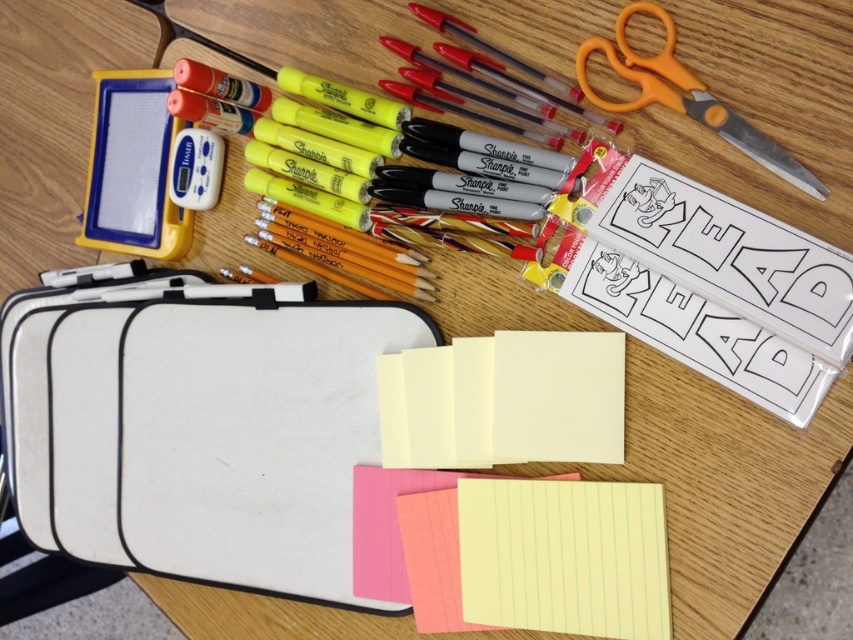
You are organizing school supplies on a desk and need to place a new item between the yellow paper notepad at center and the orange plastic scissors at upper right. Which object should you place the new item closer to based on their heights?

The yellow paper notepad at center is shorter than the orange plastic scissors at upper right. Therefore, the new item should be placed closer to the yellow paper notepad at center since it is shorter.

You are organizing school supplies on a desk. You have an orange plastic scissors at upper right and a lined paper at center. Which object is taller?

The orange plastic scissors at upper right is much taller than the lined paper at center.

You are organizing a classroom and need to place a new item on the desk. The desk has a wooden surface with school supplies arranged as described. There is a specific point on the desk marked at coordinates point (503, 401). What is located at this point?

The yellow paper notepad at center is located at point (503, 401).